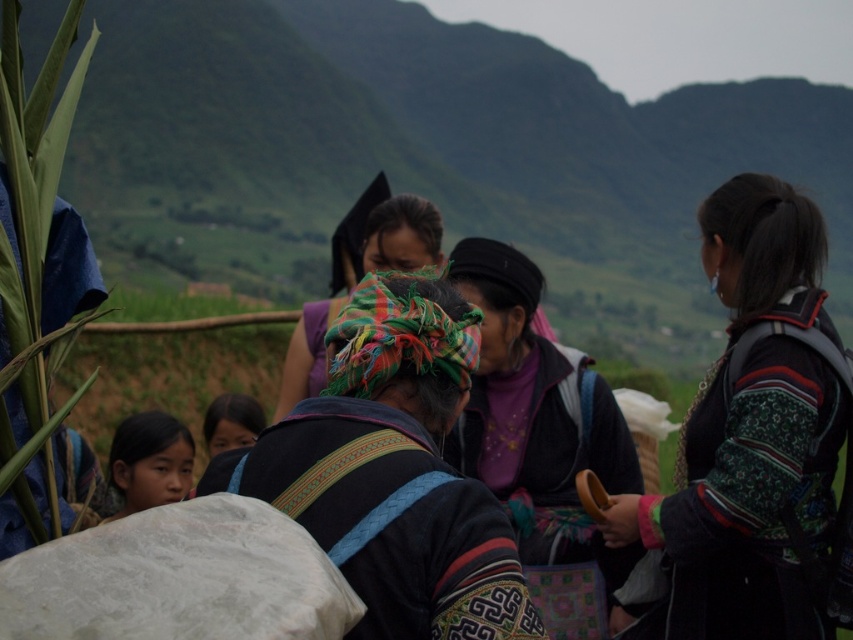
Question: Can you confirm if green textured mountain at upper center is smaller than green patterned sweater at right?

Choices:
 (A) no
 (B) yes

Answer: (A)

Question: Among these points, which one is farthest from the camera?

Choices:
 (A) (302, 397)
 (B) (573, 561)
 (C) (737, 614)

Answer: (A)

Question: Does green patterned sweater at right appear over matte black headscarf at lower left?

Choices:
 (A) yes
 (B) no

Answer: (A)

Question: Considering the relative positions of multicolored woven scarf at center and matte black headscarf at lower left in the image provided, where is multicolored woven scarf at center located with respect to matte black headscarf at lower left?

Choices:
 (A) right
 (B) left

Answer: (A)

Question: Which point appears farthest from the camera in this image?

Choices:
 (A) (422, 520)
 (B) (437, 248)
 (C) (181, 310)

Answer: (C)

Question: Which of the following is the closest to the observer?

Choices:
 (A) matte black headscarf at lower left
 (B) green woven cloth at lower left
 (C) multicolored woven scarf at center
 (D) multicolored woven headscarf at center

Answer: (B)